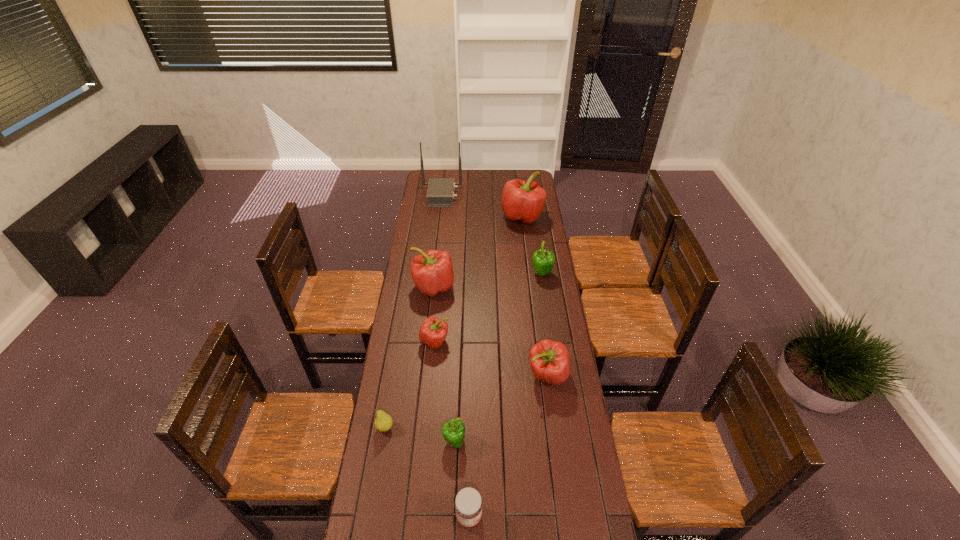
Where is `router`? This screenshot has width=960, height=540. router is located at coordinates (440, 193).

At what (x,y) coordinates should I click in order to perform the action: click on the farthest bell pepper. Please return your answer as a coordinate pair (x, y). The width and height of the screenshot is (960, 540). Looking at the image, I should click on (521, 200).

Find the location of a particular element. The height and width of the screenshot is (540, 960). the second tallest object is located at coordinates (521, 200).

You are a GUI agent. You are given a task and a screenshot of the screen. Output one action in this format:
    pyautogui.click(x=<x>, y=<y>)
    Task: Click on the third nearest pink bell pepper
    
    Given the screenshot: What is the action you would take?
    pyautogui.click(x=432, y=272)

This screenshot has width=960, height=540. Find the location of `the bigger green bell pepper`. the bigger green bell pepper is located at coordinates (543, 260).

Locate an element on the screen. Image resolution: width=960 pixels, height=540 pixels. the right green bell pepper is located at coordinates (543, 260).

At what (x,y) coordinates should I click in order to perform the action: click on the nearest pink bell pepper. Please return your answer as a coordinate pair (x, y). Image resolution: width=960 pixels, height=540 pixels. Looking at the image, I should click on (550, 361).

Find the location of `the sixth farthest object`. the sixth farthest object is located at coordinates (550, 361).

The height and width of the screenshot is (540, 960). Find the location of `the nearest bell pepper`. the nearest bell pepper is located at coordinates (453, 431).

Identify the location of the nearer green bell pepper. Image resolution: width=960 pixels, height=540 pixels. tap(453, 431).